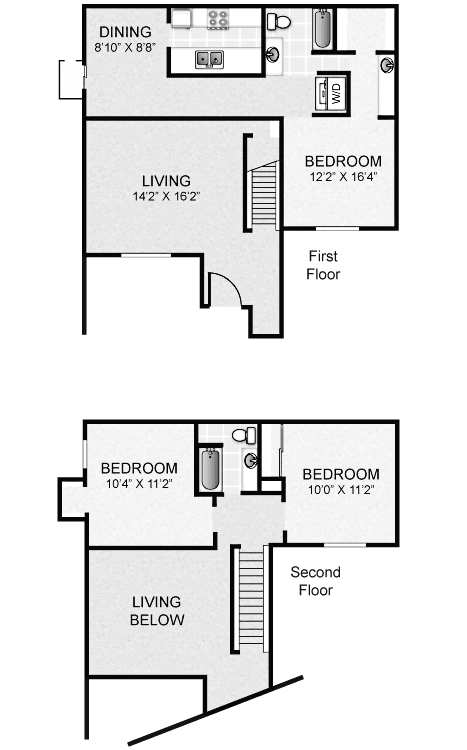
The width and height of the screenshot is (467, 750). I want to click on rooms in a floor plan, so click(x=128, y=81), click(x=334, y=172), click(x=147, y=174), click(x=152, y=475), click(x=315, y=469), click(x=155, y=598).